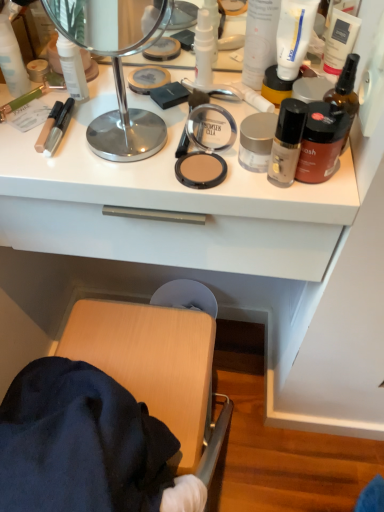
At what (x,y) coordinates should I click in order to perform the action: click on vacant area that lies between matte white lotion at upper left, the 1th toiletry in the left-to-right sequence, and white matte lotion at upper right, positioned as the 6th toiletry in right-to-left order. Please return your answer as a coordinate pair (x, y). Looking at the image, I should click on (136, 87).